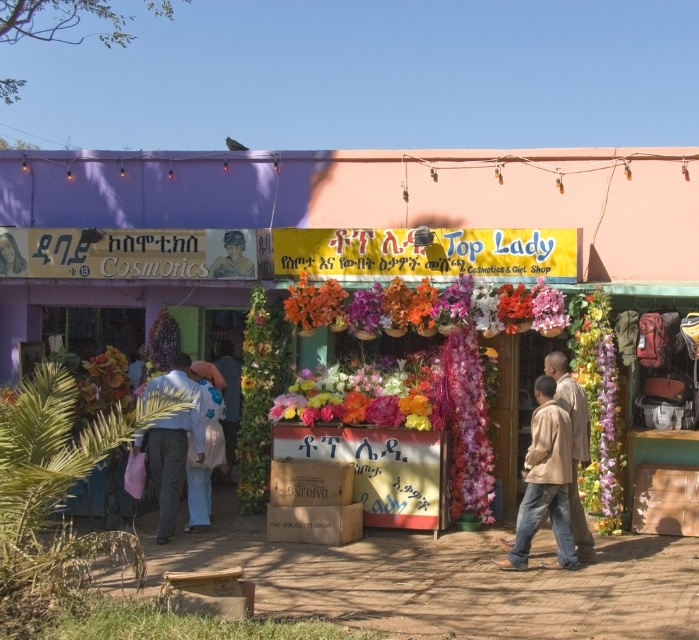
Which is in front, point (570, 448) or point (208, 269)?

Point (570, 448) is in front.

Between point (563, 525) and point (233, 257), which one is positioned behind?

Positioned behind is point (233, 257).

The height and width of the screenshot is (640, 699). I want to click on brown cotton jacket at lower right, so click(x=545, y=481).

Who is shorter, glossy floral bouquet at center or blue fabric shirt at center?

Standing shorter between the two is glossy floral bouquet at center.

Who is positioned more to the left, glossy floral bouquet at center or blue fabric shirt at center?

Positioned to the left is blue fabric shirt at center.

Does point (425, 365) come farther from viewer compared to point (165, 518)?

Yes, point (425, 365) is behind point (165, 518).

The height and width of the screenshot is (640, 699). Find the location of `glossy floral bouquet at center`. glossy floral bouquet at center is located at coordinates (360, 394).

The height and width of the screenshot is (640, 699). I want to click on floral fabric bouquet at center, so click(x=315, y=304).

Is point (315, 312) positioned before point (236, 244)?

Yes, it is in front of point (236, 244).

Identify the location of floral fabric bouquet at center. (315, 304).